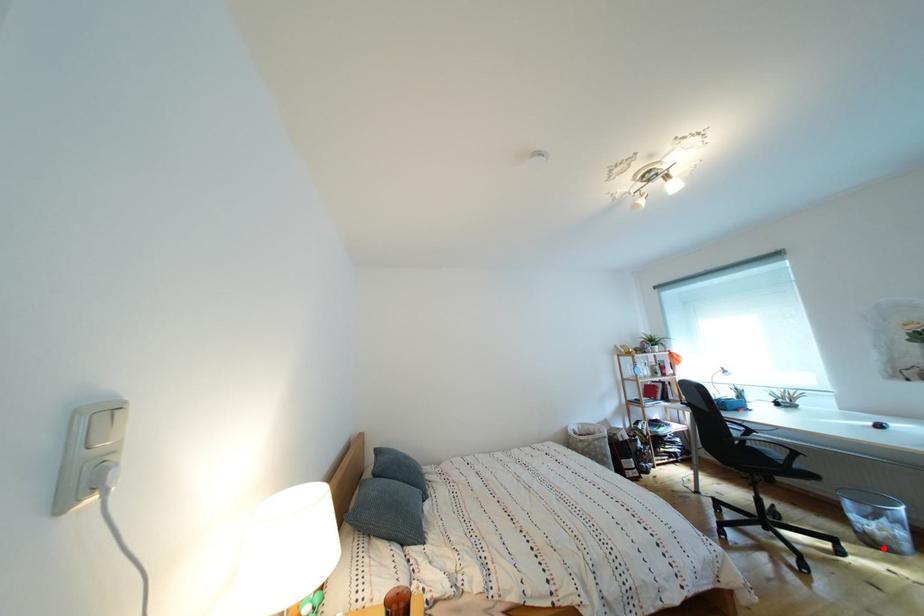
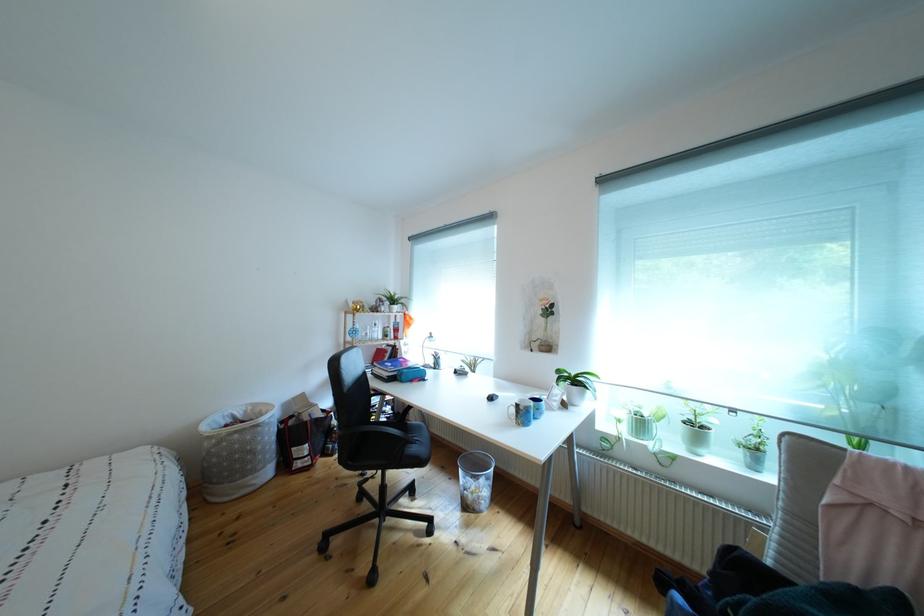
Question: A red point is marked in image1. In image2, is the corresponding 3D point closer to the camera or farther? Reply with the corresponding letter.

Choices:
 (A) The corresponding 3D point is closer.
 (B) The corresponding 3D point is farther.

Answer: (B)